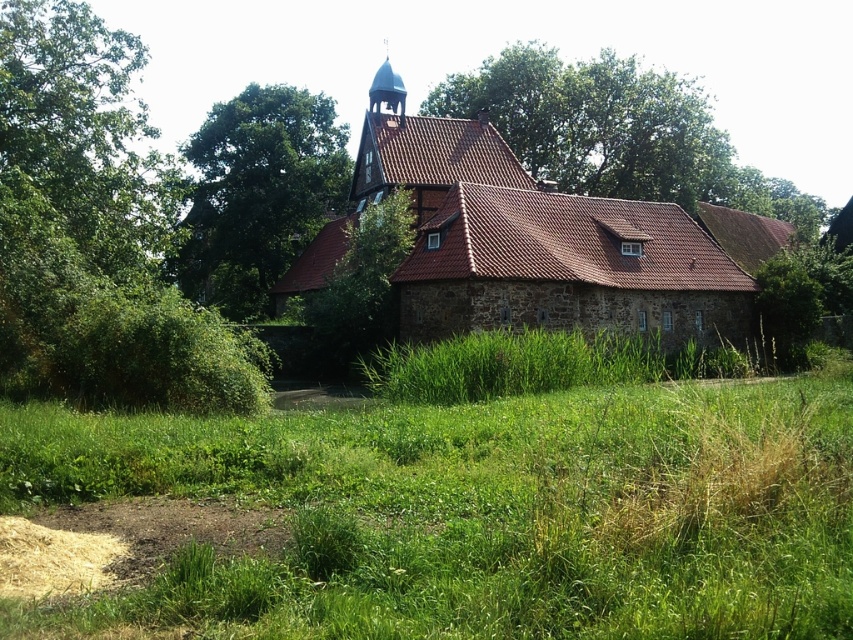
You are a gardener planning to mow the lawn around the green grass at center and the green leafy tree at upper center. Which area requires more attention in terms of space coverage?

The green leafy tree at upper center requires more attention because it occupies more space than the green grass at center.

You are standing in front of the rustic stone building with a red tiled roof. You see the green grass at center and the green leafy tree at upper center. Which object is closer to you?

The green grass at center is closer to you since it is only 187.98 feet away from the green leafy tree at upper center, meaning the grass is nearer than the tree.

You are a gardener planning to plant a new tree in the area near the light brown shredded hay at lower left. Considering the space available, would the green leafy tree at upper left be able to fit in that location without overcrowding the area?

The green leafy tree at upper left is larger in size compared to the light brown shredded hay at lower left. Since the tree is bigger, planting it in the area near the hay might cause overcrowding due to its larger size.